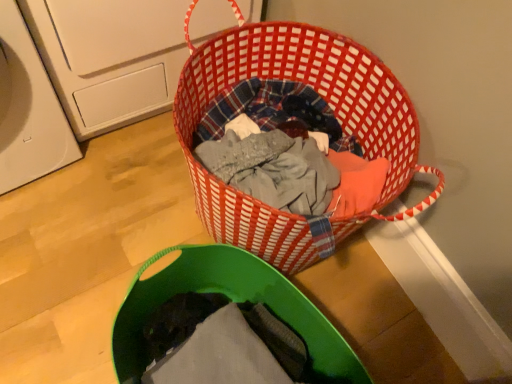
This screenshot has width=512, height=384. Describe the element at coordinates (109, 57) in the screenshot. I see `white plastic washing machine at left` at that location.

I want to click on green fabric laundry basket at lower center, so click(234, 301).

Locate an element on the screen. The image size is (512, 384). red woven basket at center is located at coordinates (324, 98).

Looking at this image, between green fabric laundry basket at lower center and white plastic washing machine at left, which one has larger size?

white plastic washing machine at left.

Which object is wider, green fabric laundry basket at lower center or white plastic washing machine at left?

With larger width is white plastic washing machine at left.

From a real-world perspective, is green fabric laundry basket at lower center over white plastic washing machine at left?

No, from a real-world perspective, green fabric laundry basket at lower center is not over white plastic washing machine at left

How different are the orientations of green fabric laundry basket at lower center and white plastic washing machine at left in degrees?

83.1 degrees.

Is white plastic washing machine at left to the left of red woven basket at center from the viewer's perspective?

Indeed, white plastic washing machine at left is positioned on the left side of red woven basket at center.

Is white plastic washing machine at left closer to camera compared to red woven basket at center?

No, white plastic washing machine at left is behind red woven basket at center.

Is white plastic washing machine at left inside or outside of red woven basket at center?

white plastic washing machine at left is not enclosed by red woven basket at center.

Considering the positions of points (116, 122) and (239, 70), is point (116, 122) closer to camera compared to point (239, 70)?

No.

Does red woven basket at center contain white plastic washing machine at left?

No, red woven basket at center does not contain white plastic washing machine at left.

How many degrees apart are the facing directions of red woven basket at center and white plastic washing machine at left?

The angular difference between red woven basket at center and white plastic washing machine at left is 92.6 degrees.

Is red woven basket at center positioned far away from white plastic washing machine at left?

That's not correct — red woven basket at center is a little close to white plastic washing machine at left.

Between red woven basket at center and white plastic washing machine at left, which one appears on the right side from the viewer's perspective?

From the viewer's perspective, red woven basket at center appears more on the right side.

Is the surface of red woven basket at center in direct contact with green fabric laundry basket at lower center?

No, red woven basket at center is not next to green fabric laundry basket at lower center.

From the image's perspective, is red woven basket at center on top of green fabric laundry basket at lower center?

Correct, red woven basket at center appears higher than green fabric laundry basket at lower center in the image.

Which is correct: red woven basket at center is inside green fabric laundry basket at lower center, or outside of it?

The correct answer is: outside.

Based on the photo, between red woven basket at center and green fabric laundry basket at lower center, which one is positioned in front?

Positioned in front is green fabric laundry basket at lower center.

Who is more distant, white plastic washing machine at left or green fabric laundry basket at lower center?

white plastic washing machine at left is further from the camera.

Is white plastic washing machine at left inside the boundaries of green fabric laundry basket at lower center, or outside?

white plastic washing machine at left is not inside green fabric laundry basket at lower center, it's outside.

Is white plastic washing machine at left looking in the opposite direction of green fabric laundry basket at lower center?

No, white plastic washing machine at left's orientation is not away from green fabric laundry basket at lower center.

What's the angular difference between white plastic washing machine at left and green fabric laundry basket at lower center's facing directions?

There is a 83.1-degree angle between the facing directions of white plastic washing machine at left and green fabric laundry basket at lower center.

From a real-world perspective, is green fabric laundry basket at lower center positioned above or below red woven basket at center?

Clearly, from a real-world perspective, green fabric laundry basket at lower center is above red woven basket at center.

Is green fabric laundry basket at lower center oriented away from red woven basket at center?

That's not correct — green fabric laundry basket at lower center is not looking away from red woven basket at center.

Which of these two, green fabric laundry basket at lower center or red woven basket at center, is wider?

red woven basket at center is wider.

Does point (128, 380) come behind point (279, 218)?

Yes, point (128, 380) is farther from viewer.

Locate an element on the screen. The height and width of the screenshot is (384, 512). washing machine lying above the green fabric laundry basket at lower center (from the image's perspective) is located at coordinates (109, 57).

Identify the location of washing machine that appears behind the red woven basket at center. This screenshot has width=512, height=384. (109, 57).

Which object lies nearer to the anchor point red woven basket at center, white plastic washing machine at left or green fabric laundry basket at lower center?

green fabric laundry basket at lower center.

From the picture: From the image, which object appears to be farther from red woven basket at center, green fabric laundry basket at lower center or white plastic washing machine at left?

The object further to red woven basket at center is white plastic washing machine at left.

Which object lies nearer to the anchor point white plastic washing machine at left, green fabric laundry basket at lower center or red woven basket at center?

Based on the image, red woven basket at center appears to be nearer to white plastic washing machine at left.

Based on their spatial positions, is red woven basket at center or white plastic washing machine at left closer to green fabric laundry basket at lower center?

The object closer to green fabric laundry basket at lower center is red woven basket at center.

From the image, which object appears to be nearer to green fabric laundry basket at lower center, white plastic washing machine at left or red woven basket at center?

red woven basket at center is positioned closer to the anchor green fabric laundry basket at lower center.

In the scene shown: From the image, which object appears to be farther from white plastic washing machine at left, red woven basket at center or green fabric laundry basket at lower center?

green fabric laundry basket at lower center.

The width and height of the screenshot is (512, 384). Identify the location of picnic basket between white plastic washing machine at left and green fabric laundry basket at lower center from top to bottom. pyautogui.click(x=324, y=98).